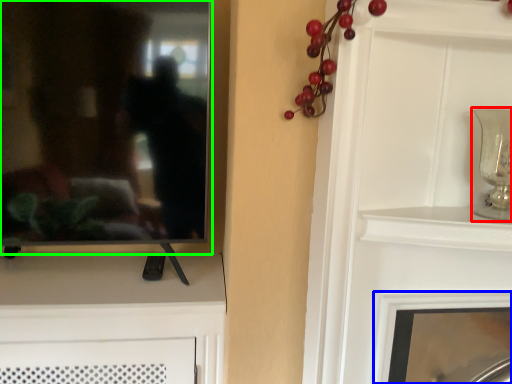
Question: Estimate the real-world distances between objects in this image. Which object is closer to candle holder (highlighted by a red box), fireplace (highlighted by a blue box) or mirror (highlighted by a green box)?

Choices:
 (A) fireplace
 (B) mirror

Answer: (A)